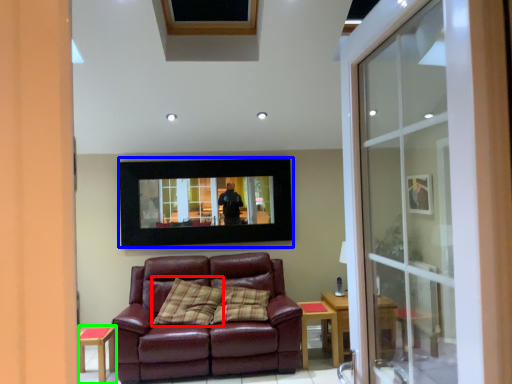
Question: Considering the real-world distances, which object is farthest from pillow (highlighted by a red box)? picture frame (highlighted by a blue box) or side table (highlighted by a green box)?

Choices:
 (A) picture frame
 (B) side table

Answer: (A)